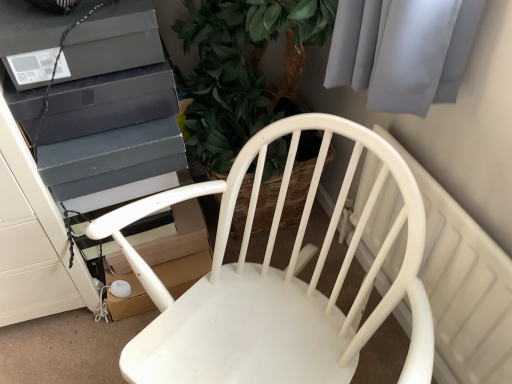
Question: Considering the positions of point (16, 26) and point (278, 127), is point (16, 26) closer or farther from the camera than point (278, 127)?

Choices:
 (A) farther
 (B) closer

Answer: (B)

Question: Would you say matte black speaker at upper left, marked as the first appliance in a top-to-bottom arrangement, is inside or outside white matte chair at center?

Choices:
 (A) inside
 (B) outside

Answer: (B)

Question: Which of these objects is positioned farthest from the white plastic radiator at upper right?

Choices:
 (A) matte black speaker at upper left, the second appliance ordered from the bottom
 (B) matte black box at upper left, which is counted as the 2th appliance, starting from the top
 (C) white matte chair at center

Answer: (A)

Question: Based on their relative distances, which object is farther from the matte black speaker at upper left, marked as the first appliance in a top-to-bottom arrangement?

Choices:
 (A) matte black box at upper left, which is counted as the 2th appliance, starting from the top
 (B) white matte chair at center
 (C) white plastic radiator at upper right

Answer: (C)